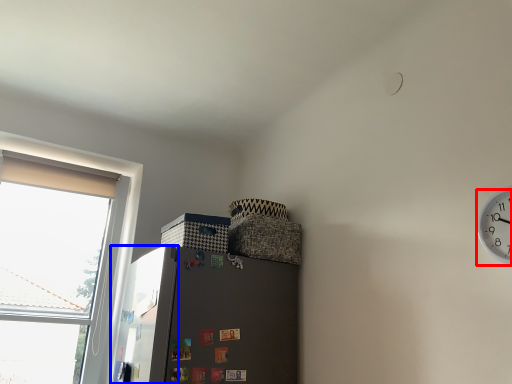
Question: Which of the following is the closest to the observer, clock (highlighted by a red box) or screen door (highlighted by a blue box)?

Choices:
 (A) clock
 (B) screen door

Answer: (A)